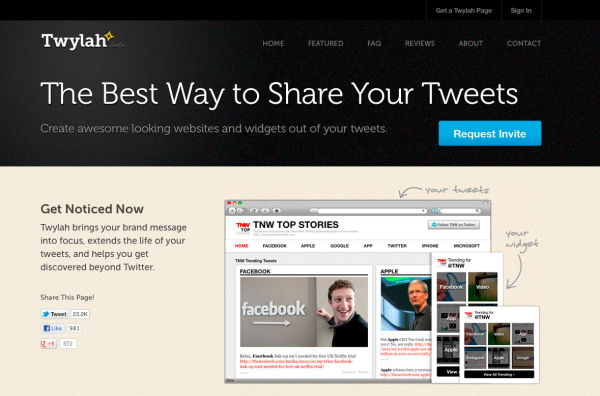
I want to click on window, so click(491, 350).